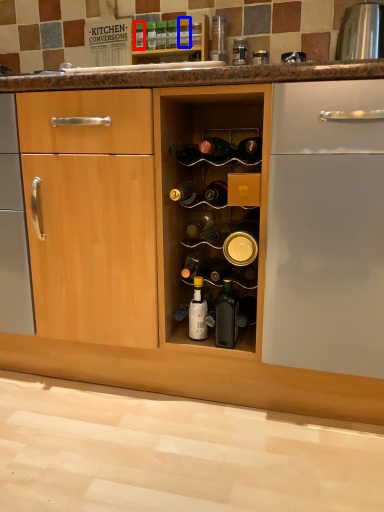
Question: Which object is further to the camera taking this photo, bottle (highlighted by a red box) or bottle (highlighted by a blue box)?

Choices:
 (A) bottle
 (B) bottle

Answer: (A)